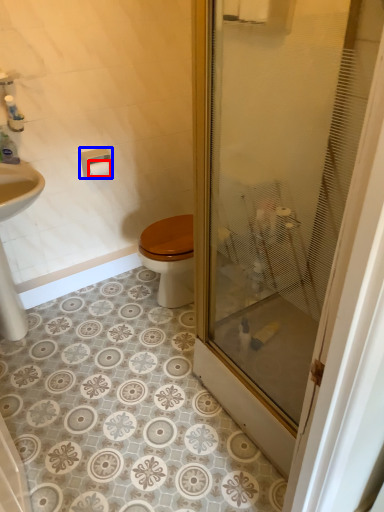
Question: Which of the following is the closest to the observer, toilet paper (highlighted by a red box) or towel bar (highlighted by a blue box)?

Choices:
 (A) toilet paper
 (B) towel bar

Answer: (B)